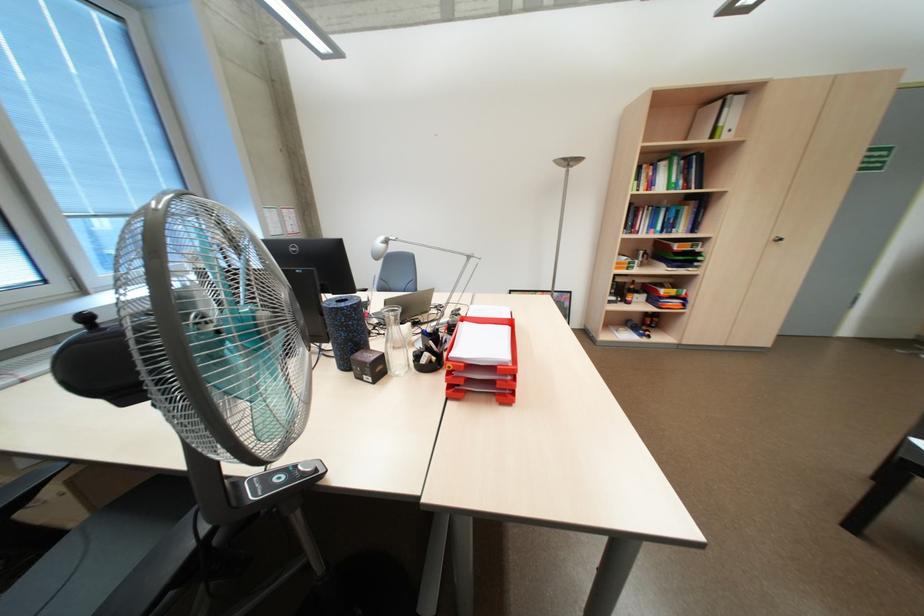
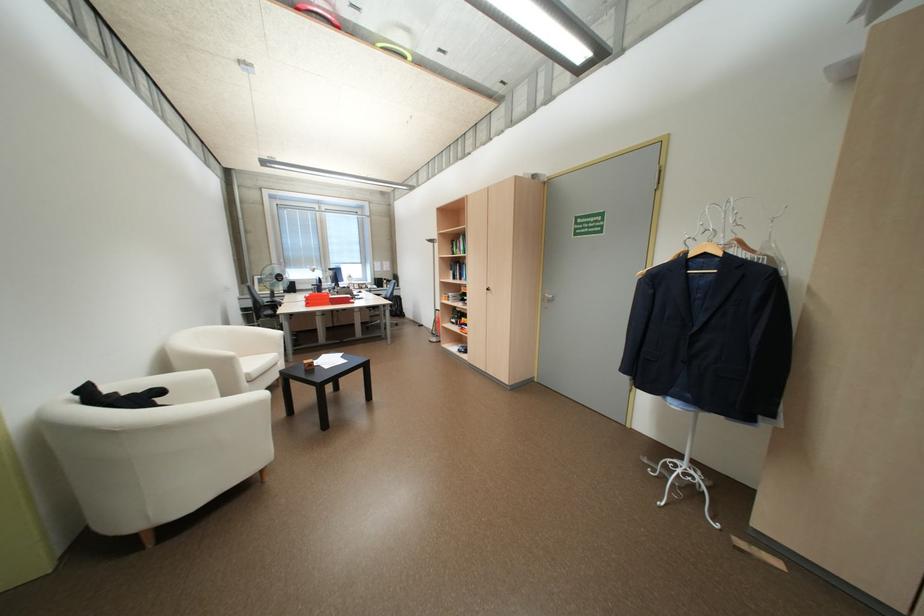
Question: I am providing you with two images of the same scene from different viewpoints. Please identify which objects are invisible in image2.

Choices:
 (A) white chair armrest
 (B) blue table marker
 (C) black chair armrest
 (D) red file holder

Answer: (C)